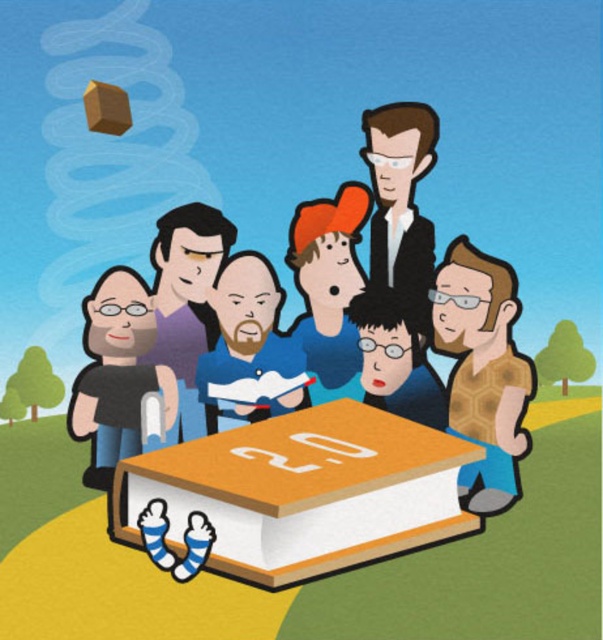
Is point (473, 328) positioned before point (118, 301)?

Yes, it is in front of point (118, 301).

Who is higher up, brown honeycomb-patterned shirt at lower right or dark gray shirt at lower left?

brown honeycomb-patterned shirt at lower right

This screenshot has height=640, width=603. I want to click on brown honeycomb-patterned shirt at lower right, so click(482, 371).

Who is higher up, black glossy suit at upper center or blue cotton shirt at center?

Positioned higher is black glossy suit at upper center.

Is black glossy suit at upper center above blue cotton shirt at center?

Yes, black glossy suit at upper center is above blue cotton shirt at center.

Which is behind, point (435, 115) or point (238, 346)?

Point (238, 346)

Find the location of a particular element. This screenshot has width=603, height=640. black glossy suit at upper center is located at coordinates (402, 202).

Which is above, brown textured shirt at center or orange fabric cap at center?

orange fabric cap at center is higher up.

What do you see at coordinates (166, 296) in the screenshot?
I see `brown textured shirt at center` at bounding box center [166, 296].

Locate an element on the screen. brown textured shirt at center is located at coordinates (166, 296).